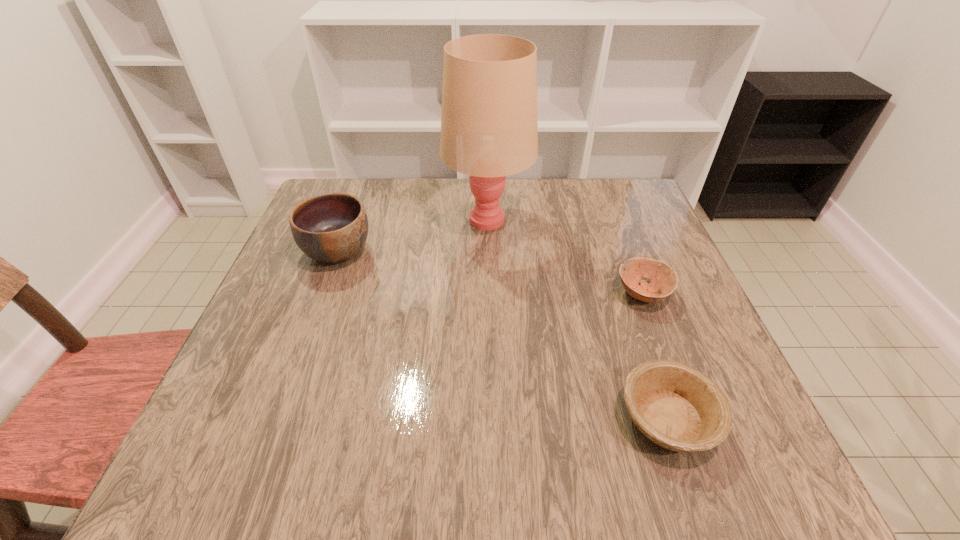
At what (x,y) coordinates should I click in order to perform the action: click on object at the left edge. Please return your answer as a coordinate pair (x, y). The height and width of the screenshot is (540, 960). Looking at the image, I should click on (332, 228).

The image size is (960, 540). In order to click on object that is at the near right corner in this screenshot , I will do (676, 406).

Identify the location of free space at the far edge of the desktop. The height and width of the screenshot is (540, 960). (397, 211).

Locate an element on the screen. vacant region at the near edge of the desktop is located at coordinates (552, 481).

This screenshot has width=960, height=540. In order to click on vacant space at the left edge in this screenshot , I will do `click(237, 379)`.

The height and width of the screenshot is (540, 960). In the image, there is a desktop. What are the coordinates of `vacant space at the far right corner` in the screenshot? It's located at (605, 186).

You are a GUI agent. You are given a task and a screenshot of the screen. Output one action in this format:
    pyautogui.click(x=<x>, y=<y>)
    Task: Click on the unoccupied position between the second tallest object and the tallest object
    The image size is (960, 540).
    Given the screenshot: What is the action you would take?
    pyautogui.click(x=413, y=235)

This screenshot has height=540, width=960. Find the location of `vacant space that is in between the nearest bowl and the tallest object`. vacant space that is in between the nearest bowl and the tallest object is located at coordinates (578, 319).

What are the coordinates of `free space between the tallest bowl and the nearest bowl` in the screenshot? It's located at (503, 335).

Locate an element on the screen. Image resolution: width=960 pixels, height=540 pixels. vacant area that lies between the leftmost object and the nearest object is located at coordinates (503, 335).